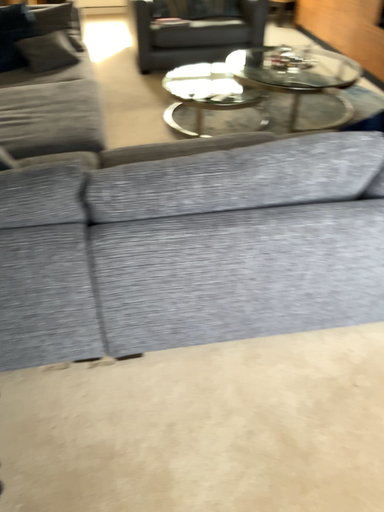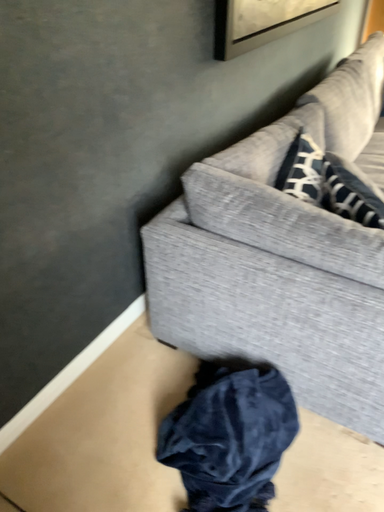
Question: How did the camera likely rotate when shooting the video?

Choices:
 (A) rotated left
 (B) rotated right

Answer: (A)